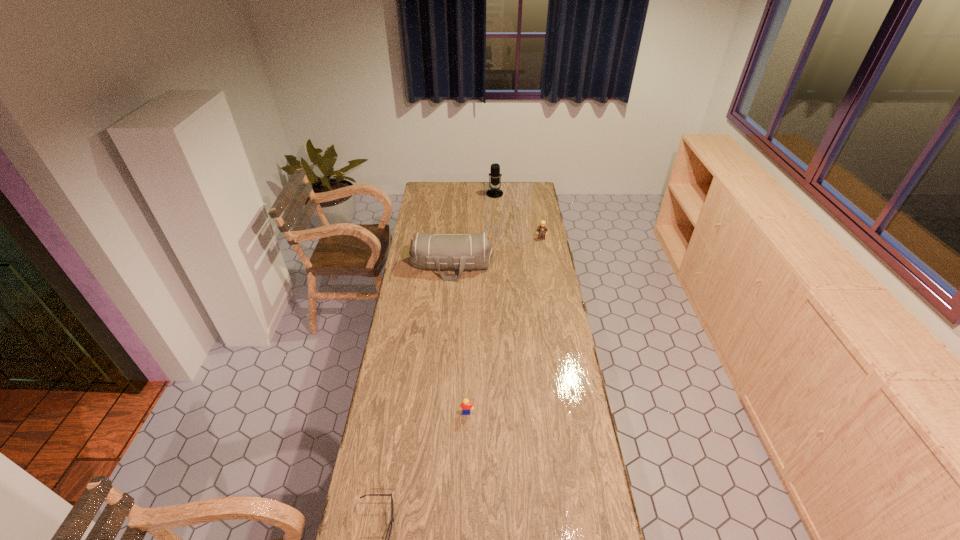
Identify the location of free space between the duffel bag and the fourth tallest object. This screenshot has height=540, width=960. (459, 339).

The height and width of the screenshot is (540, 960). I want to click on blank region between the shorter Lego and the farthest object, so click(481, 303).

Identify the location of the closest object to the second shortest object. (391, 522).

Locate which object ranks second in proximity to the nearest object. Please provide its 2D coordinates. Your answer should be formatted as a tuple, i.e. [(x, y)], where the tuple contains the x and y coordinates of a point satisfying the conditions above.

[(438, 251)]